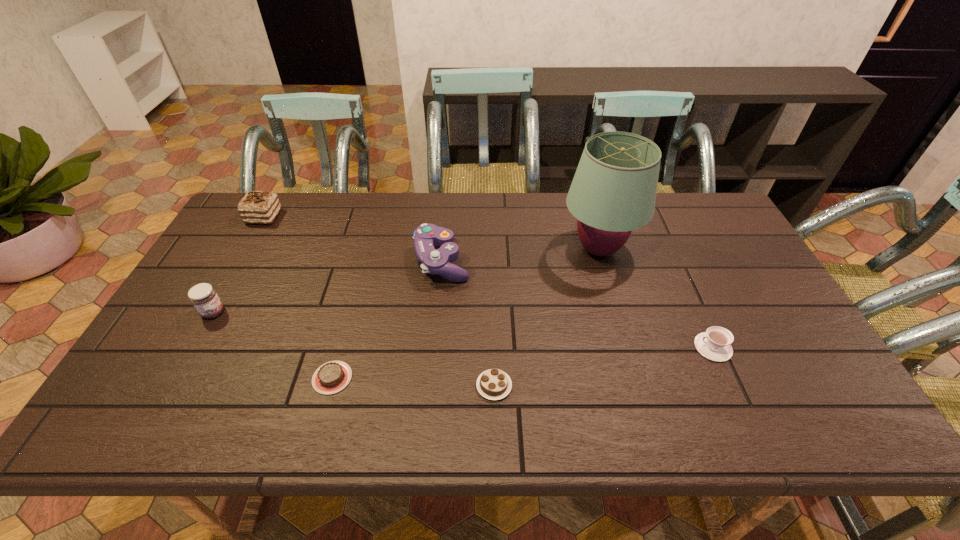
Where is `empty space that is in between the lampshade and the rightmost chocolate cake`? The image size is (960, 540). empty space that is in between the lampshade and the rightmost chocolate cake is located at coordinates (546, 318).

Where is `free spot between the fifth tallest object and the sixth object from left to right`? The image size is (960, 540). free spot between the fifth tallest object and the sixth object from left to right is located at coordinates (656, 298).

Find the location of `empty space between the fourth nearest object and the tallest object`. empty space between the fourth nearest object and the tallest object is located at coordinates (406, 281).

Locate an element on the screen. free space between the leftmost chocolate cake and the rightmost chocolate cake is located at coordinates (379, 301).

At what (x,y) coordinates should I click in order to perform the action: click on empty space that is in between the tallest object and the fifth tallest object. Please return your answer as a coordinate pair (x, y). The image size is (960, 540). Looking at the image, I should click on (656, 298).

This screenshot has height=540, width=960. What are the coordinates of `free space between the control and the rightmost chocolate cake` in the screenshot? It's located at (468, 323).

Where is `empty location between the jam and the rightmost chocolate cake`? Image resolution: width=960 pixels, height=540 pixels. empty location between the jam and the rightmost chocolate cake is located at coordinates (354, 349).

You are a GUI agent. You are given a task and a screenshot of the screen. Output one action in this format:
    pyautogui.click(x=<x>, y=<y>)
    Task: Click on the free space that is in between the farthest chocolate cake and the rightmost chocolate cake
    The image size is (960, 540).
    Given the screenshot: What is the action you would take?
    pyautogui.click(x=379, y=301)

The image size is (960, 540). In order to click on vacant area between the rightmost chocolate cake and the fourth farthest object in this screenshot , I will do 354,349.

Where is `object that ranks as the fifth closest to the tallest object`? This screenshot has width=960, height=540. object that ranks as the fifth closest to the tallest object is located at coordinates (257, 207).